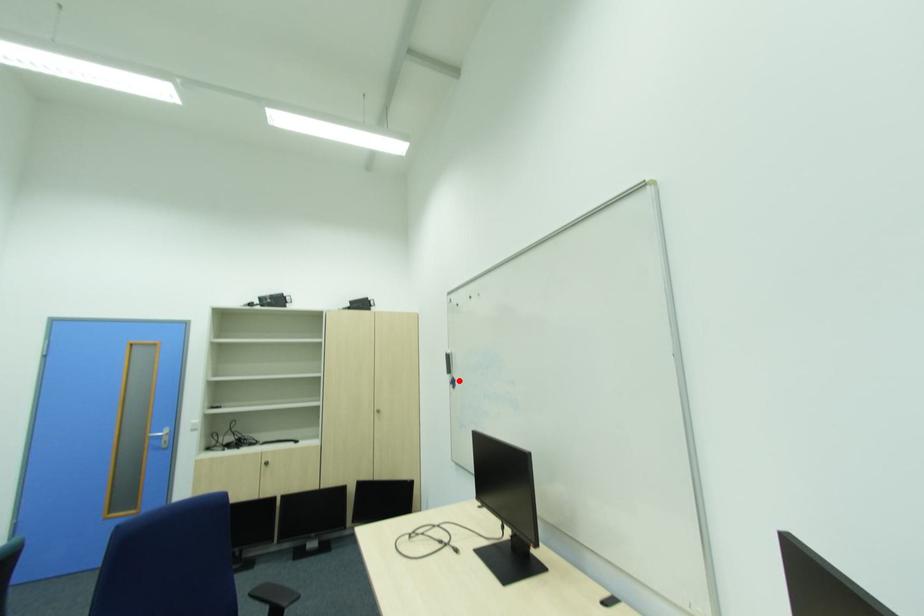
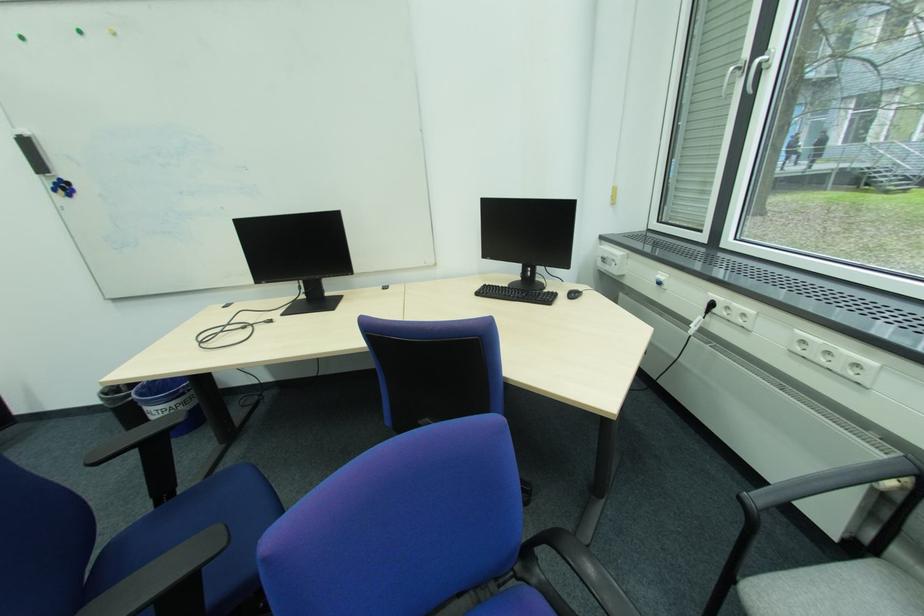
Locate, in the second image, the point that corresponds to the highlighted location in the first image.

(62, 185)